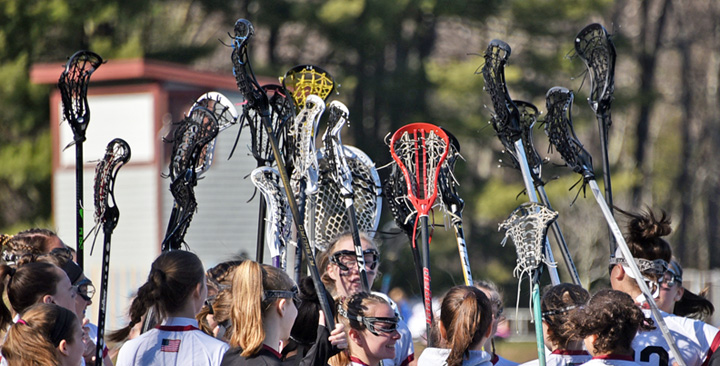
The width and height of the screenshot is (720, 366). I want to click on box, so click(134, 217).